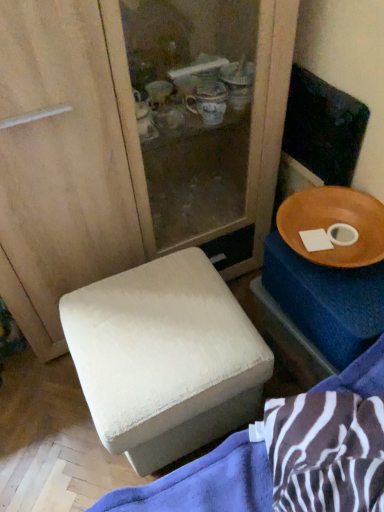
Locate an element on the screen. This screenshot has height=512, width=384. free region under wooden bowl at right (from a real-world perspective) is located at coordinates (326, 245).